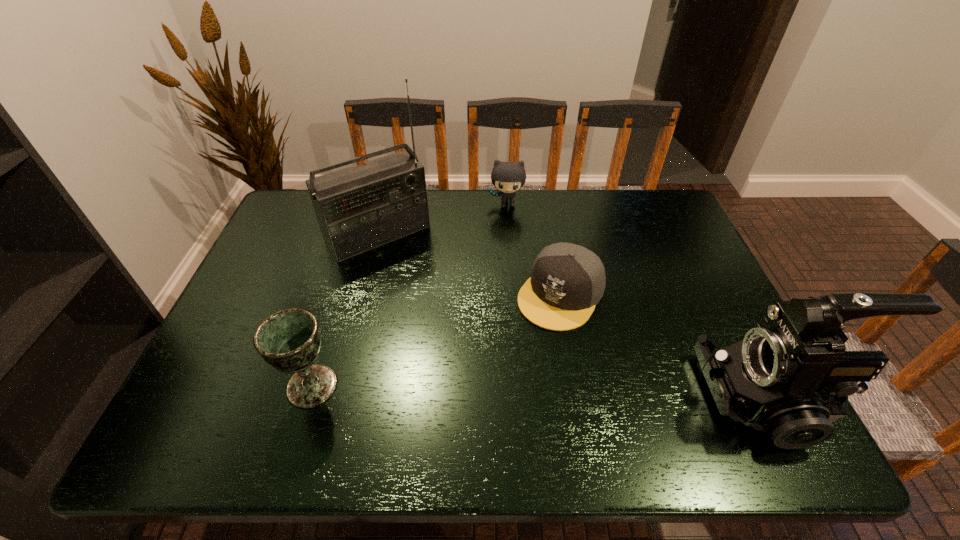
Image resolution: width=960 pixels, height=540 pixels. I want to click on vacant point located 0.100m on the front panel of the tallest object, so click(418, 278).

Where is `vacant space situated 0.130m on the front panel of the tallest object`? vacant space situated 0.130m on the front panel of the tallest object is located at coordinates (422, 285).

Find the location of `vacant space located on the front panel of the tallest object`. vacant space located on the front panel of the tallest object is located at coordinates (418, 278).

At what (x,y) coordinates should I click in order to perform the action: click on free region located on the front-facing side of the cap. Please return your answer as a coordinate pair (x, y). This screenshot has height=540, width=960. Looking at the image, I should click on (492, 393).

Identify the location of vacant space situated 0.120m on the front-facing side of the cap. The height and width of the screenshot is (540, 960). (517, 359).

At what (x,y) coordinates should I click in order to perform the action: click on vacant space located 0.240m on the front-facing side of the cap. Please return your answer as a coordinate pair (x, y). The width and height of the screenshot is (960, 540). Looking at the image, I should click on (491, 396).

Find the location of a particular element. This screenshot has width=960, height=540. free spot located on the front-facing side of the second shortest object is located at coordinates (505, 228).

Where is `free location located 0.070m on the front-facing side of the second shortest object`? Image resolution: width=960 pixels, height=540 pixels. free location located 0.070m on the front-facing side of the second shortest object is located at coordinates (505, 226).

At what (x,y) coordinates should I click in order to perform the action: click on vacant space situated 0.170m on the front-facing side of the second shortest object. Please return your answer as a coordinate pair (x, y). Looking at the image, I should click on (504, 246).

Image resolution: width=960 pixels, height=540 pixels. Find the location of `radio receiver that is at the far edge`. radio receiver that is at the far edge is located at coordinates (360, 208).